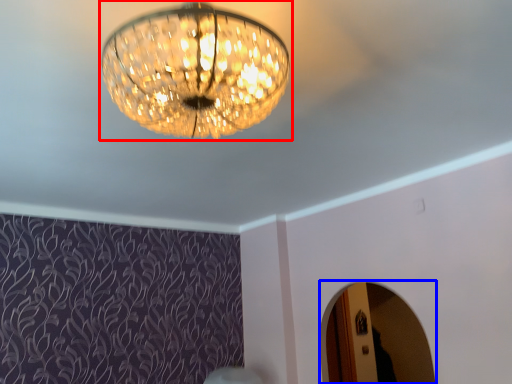
Question: Which object appears closest to the camera in this image, lamp (highlighted by a red box) or mirror (highlighted by a blue box)?

Choices:
 (A) lamp
 (B) mirror

Answer: (A)